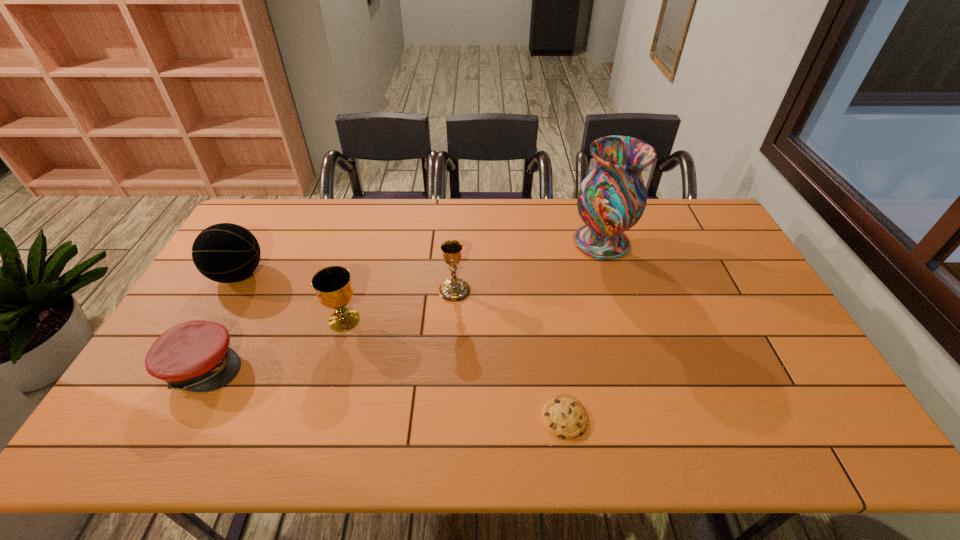
The image size is (960, 540). In order to click on vacant space located 0.090m on the left of the tallest object in this screenshot , I will do `click(544, 242)`.

You are a GUI agent. You are given a task and a screenshot of the screen. Output one action in this format:
    pyautogui.click(x=<x>, y=<y>)
    Task: Click on the vacant space located on the right of the basketball
    
    Given the screenshot: What is the action you would take?
    pyautogui.click(x=311, y=275)

Locate an element on the screen. vacant space situated 0.270m on the right of the farther chalice is located at coordinates (558, 291).

At what (x,y) coordinates should I click in order to perform the action: click on vacant space located on the back of the nearer chalice. Please return your answer as a coordinate pair (x, y). Looking at the image, I should click on (367, 242).

The image size is (960, 540). In order to click on free space located on the front of the second shortest object with an emblem in this screenshot , I will do `click(318, 366)`.

The width and height of the screenshot is (960, 540). I want to click on free spot located 0.150m on the right of the shortest object, so click(650, 417).

The image size is (960, 540). Identify the location of object located at the far edge. pos(612,198).

At what (x,y) coordinates should I click in order to perform the action: click on object at the near edge. Please return your answer as a coordinate pair (x, y). Looking at the image, I should click on (563, 416).

The height and width of the screenshot is (540, 960). I want to click on basketball at the left edge, so [x=226, y=253].

Identify the location of cap situated at the left edge. The image size is (960, 540). pyautogui.click(x=194, y=356).